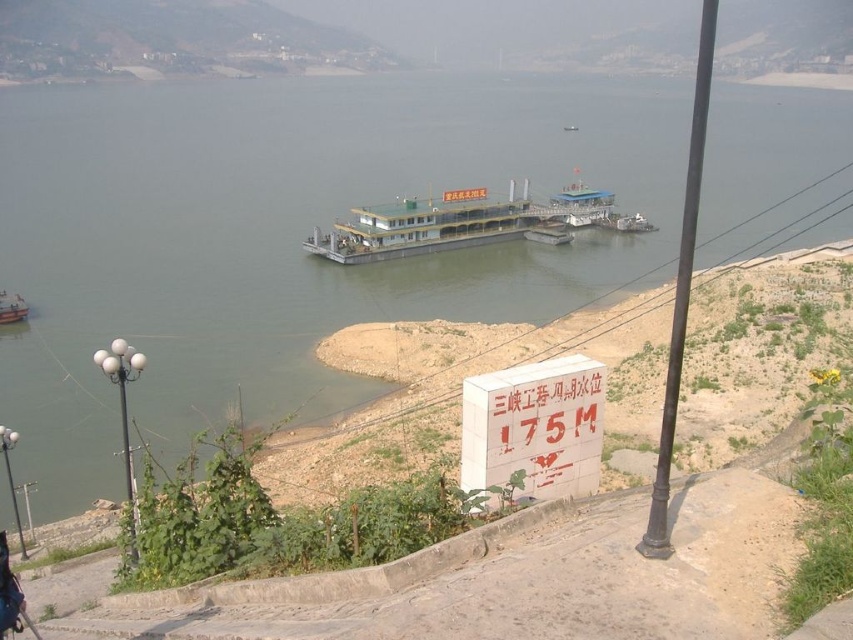
You are standing at the embankment and want to reach the point marked at coordinates point [166,141]. Given that your maximum comfortable walking distance is 500 feet, can you comfortably walk to that point without needing assistance?

The distance of point [166,141] from viewer is 518.38 feet, which exceeds your maximum comfortable walking distance of 500 feet. Therefore, you may need assistance to reach that point comfortably.

You are a boat operator who needs to navigate through a narrow channel between two rocks. The channel is only wide enough for one boat at a time. You see the green metallic ferry at center and the orange plastic boat at lower left. Which boat should you prioritize to pass through the channel first based on their widths?

The green metallic ferry at center might be wider than orange plastic boat at lower left, so it should go first to ensure it can safely pass through the narrow channel.

You are a tourist standing on the embankment near the white concrete sign at lower center and the orange plastic boat at lower left. You want to take a photo that includes both objects in the frame. Which object should you place closer to the camera to ensure both are visible and properly framed?

Since the white concrete sign at lower center is bigger than the orange plastic boat at lower left, you should place the orange plastic boat at lower left closer to the camera to balance their sizes in the photo.